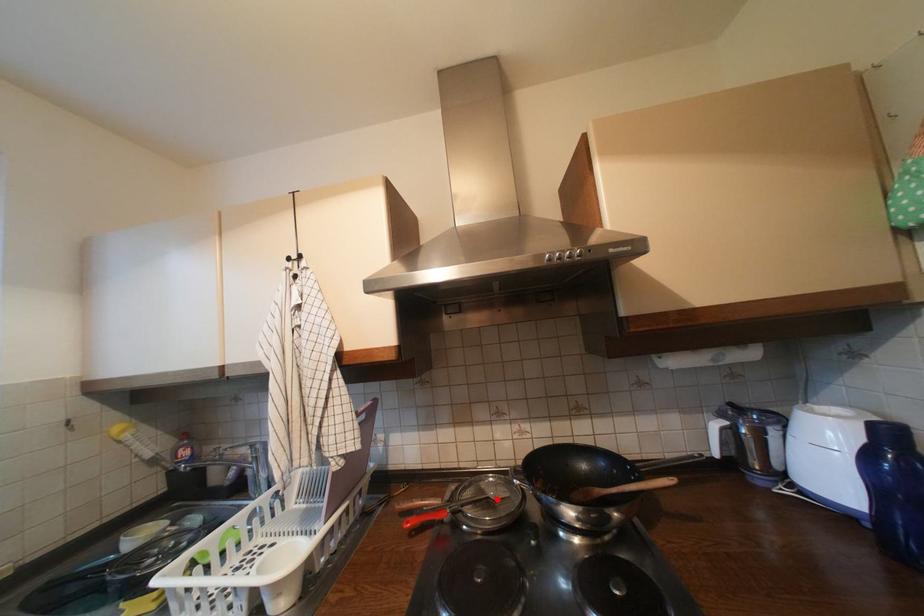
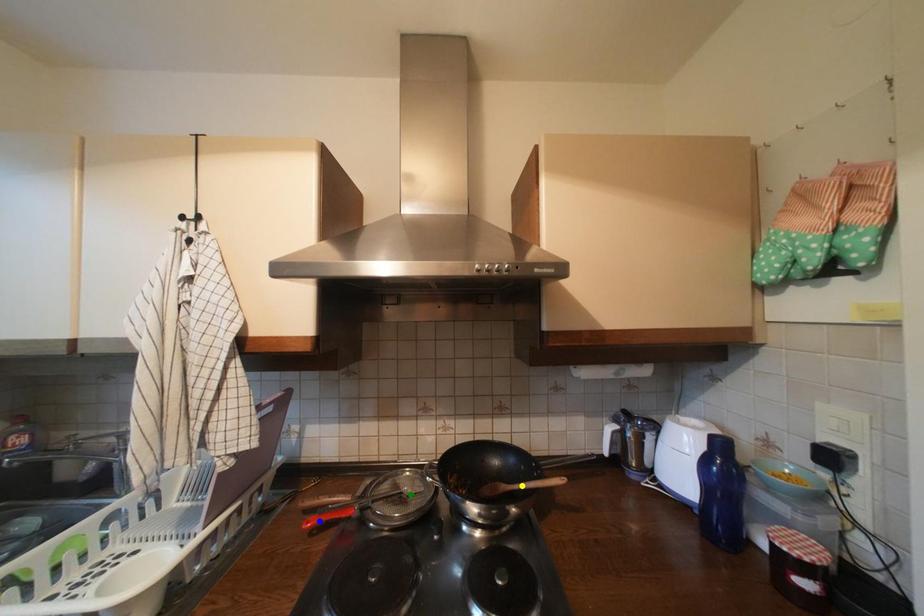
Question: I am providing you with two images of the same scene from different viewpoints. A red point is marked on the first image. You are given multiple points on the second image. Which point in image 2 represents the same 3d spot as the red point in image 1?

Choices:
 (A) blue point
 (B) yellow point
 (C) green point

Answer: (C)